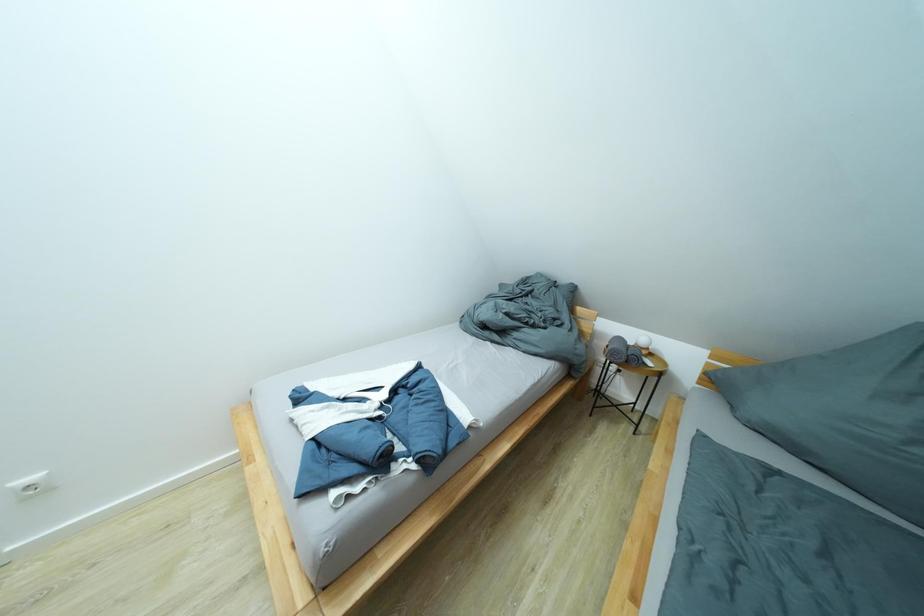
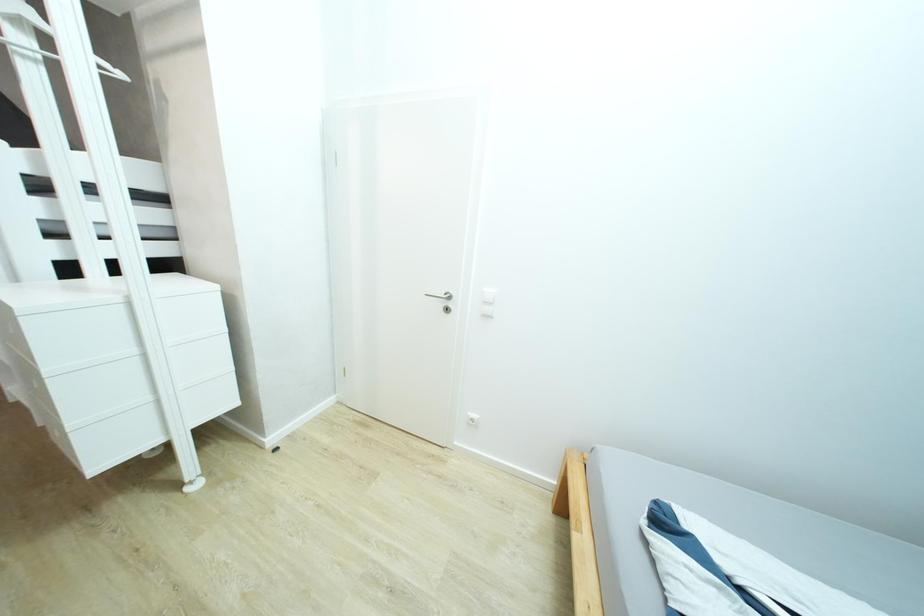
Question: Based on the continuous images, in which direction is the camera rotating? Reply with the corresponding letter.

Choices:
 (A) Left
 (B) Right
 (C) Up
 (D) Down

Answer: (A)